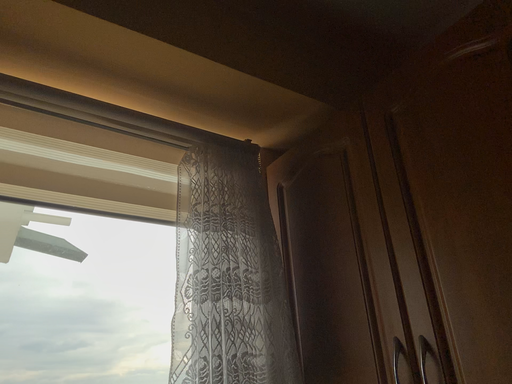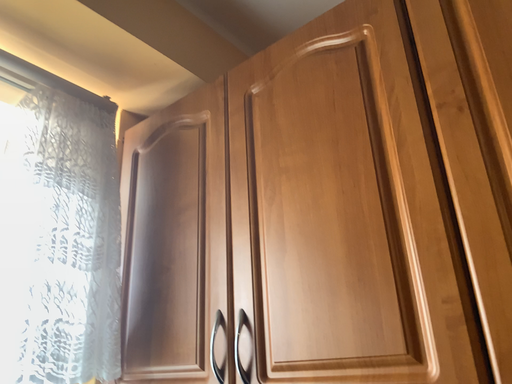
Question: How did the camera likely rotate when shooting the video?

Choices:
 (A) rotated right
 (B) rotated left

Answer: (A)